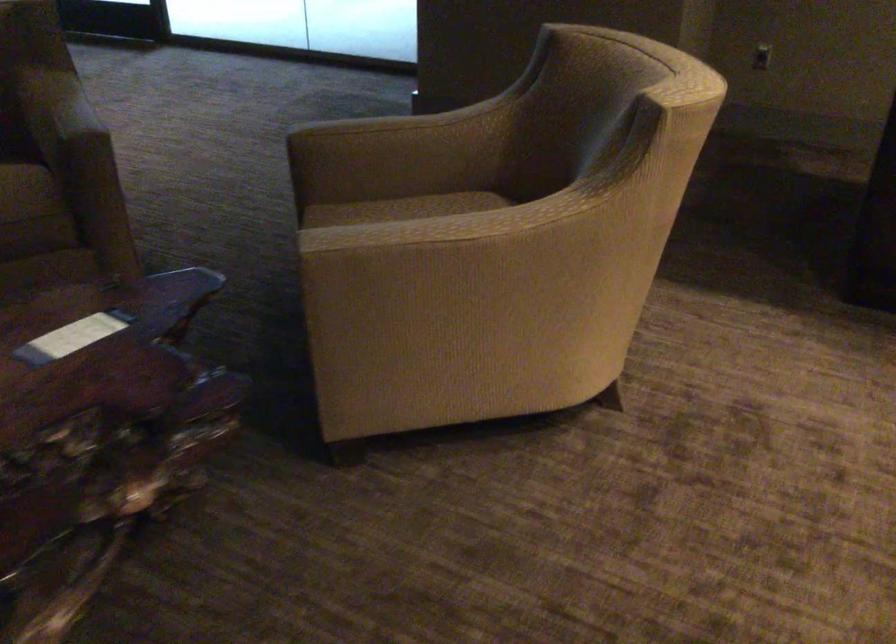
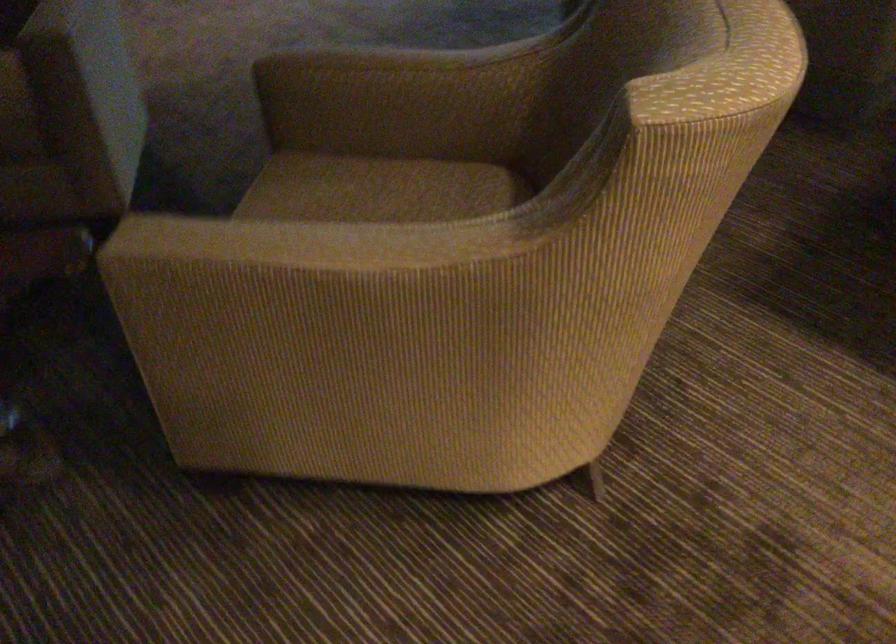
Consider the image. Which direction would the cameraman need to move to produce the second image?

The cameraman walked toward right, forward.